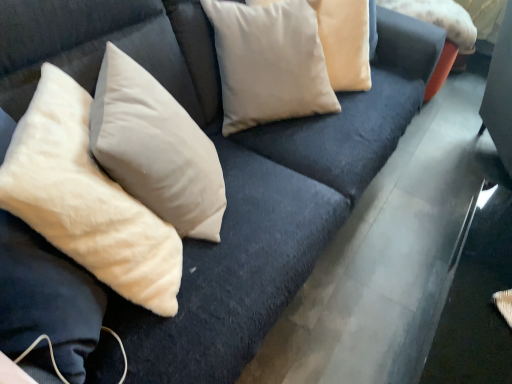
What do you see at coordinates (269, 63) in the screenshot?
I see `beige velvet pillow at upper center, acting as the 3th pillow starting from the right` at bounding box center [269, 63].

Measure the distance between point [83,258] and camera.

Point [83,258] is 33.46 inches from camera.

What is the approximate width of beige cotton pillow at upper center, placed as the 2th pillow when sorted from right to left?

The width of beige cotton pillow at upper center, placed as the 2th pillow when sorted from right to left, is 17.04 inches.

Image resolution: width=512 pixels, height=384 pixels. What are the coordinates of `beige velvet pillow at upper center, the 2th pillow viewed from the left` in the screenshot? It's located at (269, 63).

Is beige cotton pillow at upper center, which appears as the third pillow when viewed from the left, at the back of beige velvet pillow at upper center, the 2th pillow viewed from the left?

No, beige cotton pillow at upper center, which appears as the third pillow when viewed from the left, is not at the back of beige velvet pillow at upper center, the 2th pillow viewed from the left.

In the scene shown: Considering the relative sizes of beige velvet pillow at upper center, acting as the 3th pillow starting from the right, and beige cotton pillow at upper center, placed as the 2th pillow when sorted from right to left, in the image provided, is beige velvet pillow at upper center, acting as the 3th pillow starting from the right, smaller than beige cotton pillow at upper center, placed as the 2th pillow when sorted from right to left,?

Yes, beige velvet pillow at upper center, acting as the 3th pillow starting from the right, is smaller than beige cotton pillow at upper center, placed as the 2th pillow when sorted from right to left.

Is beige velvet pillow at upper center, acting as the 3th pillow starting from the right, situated inside beige cotton pillow at upper center, which appears as the third pillow when viewed from the left, or outside?

beige velvet pillow at upper center, acting as the 3th pillow starting from the right, is located beyond the bounds of beige cotton pillow at upper center, which appears as the third pillow when viewed from the left.

Considering the points (322, 89) and (350, 45), which point is in front, point (322, 89) or point (350, 45)?

The point (322, 89) is closer.

Which object is more forward, beige velvet pillow at upper center, acting as the 3th pillow starting from the right, or beige soft pillow at left, the 4th pillow viewed from the right?

beige soft pillow at left, the 4th pillow viewed from the right.

Is beige velvet pillow at upper center, acting as the 3th pillow starting from the right, facing away from beige soft pillow at left, the first pillow from the left?

beige velvet pillow at upper center, acting as the 3th pillow starting from the right, does not have its back to beige soft pillow at left, the first pillow from the left.

From a real-world perspective, which object stands above the other?

beige soft pillow at left, the first pillow from the left, is physically above.

How distant is beige velvet pillow at upper center, acting as the 3th pillow starting from the right, from beige soft pillow at left, the first pillow from the left?

A distance of 27.03 inches exists between beige velvet pillow at upper center, acting as the 3th pillow starting from the right, and beige soft pillow at left, the first pillow from the left.

From a real-world perspective, is beige soft pillow at left, the first pillow from the left, over beige cotton pillow at upper right, the fourth pillow when ordered from left to right?

Yes, from a real-world perspective, beige soft pillow at left, the first pillow from the left, is on top of beige cotton pillow at upper right, the fourth pillow when ordered from left to right.

Which object is wider, beige soft pillow at left, the first pillow from the left, or beige cotton pillow at upper right, the first pillow from the right?

beige soft pillow at left, the first pillow from the left.

Which is behind, beige soft pillow at left, the 4th pillow viewed from the right, or beige cotton pillow at upper right, the first pillow from the right?

beige cotton pillow at upper right, the first pillow from the right, is more distant.

Considering the sizes of beige soft pillow at left, the first pillow from the left, and beige cotton pillow at upper center, which appears as the third pillow when viewed from the left, in the image, is beige soft pillow at left, the first pillow from the left, bigger or smaller than beige cotton pillow at upper center, which appears as the third pillow when viewed from the left,?

beige soft pillow at left, the first pillow from the left, is bigger than beige cotton pillow at upper center, which appears as the third pillow when viewed from the left.

Is beige soft pillow at left, the first pillow from the left, touching beige cotton pillow at upper center, placed as the 2th pillow when sorted from right to left?

No, beige soft pillow at left, the first pillow from the left, is not making contact with beige cotton pillow at upper center, placed as the 2th pillow when sorted from right to left.

In the image, is beige soft pillow at left, the first pillow from the left, positioned in front of or behind beige cotton pillow at upper center, placed as the 2th pillow when sorted from right to left?

beige soft pillow at left, the first pillow from the left, is in front of beige cotton pillow at upper center, placed as the 2th pillow when sorted from right to left.

At what (x,y) coordinates should I click in order to perform the action: click on the 2nd pillow in front when counting from the beige cotton pillow at upper center, which appears as the third pillow when viewed from the left. Please return your answer as a coordinate pair (x, y). This screenshot has width=512, height=384. Looking at the image, I should click on (86, 199).

Which of these two, beige cotton pillow at upper right, the first pillow from the right, or beige soft pillow at left, the first pillow from the left, stands shorter?

With less height is beige cotton pillow at upper right, the first pillow from the right.

Is beige cotton pillow at upper right, the first pillow from the right, next to beige soft pillow at left, the first pillow from the left, and touching it?

beige cotton pillow at upper right, the first pillow from the right, is not next to beige soft pillow at left, the first pillow from the left, and they're not touching.

From a real-world perspective, is beige cotton pillow at upper right, the fourth pillow when ordered from left to right, positioned above or below beige soft pillow at left, the first pillow from the left?

In terms of real-world spatial position, beige cotton pillow at upper right, the fourth pillow when ordered from left to right, is below beige soft pillow at left, the first pillow from the left.

Could you tell me if beige cotton pillow at upper center, which appears as the third pillow when viewed from the left, is turned towards beige cotton pillow at upper right, the fourth pillow when ordered from left to right?

No, beige cotton pillow at upper center, which appears as the third pillow when viewed from the left, does not turn towards beige cotton pillow at upper right, the fourth pillow when ordered from left to right.

Does beige cotton pillow at upper center, placed as the 2th pillow when sorted from right to left, appear on the right side of beige cotton pillow at upper right, the first pillow from the right?

Incorrect, beige cotton pillow at upper center, placed as the 2th pillow when sorted from right to left, is not on the right side of beige cotton pillow at upper right, the first pillow from the right.

Is beige cotton pillow at upper center, placed as the 2th pillow when sorted from right to left, not inside beige cotton pillow at upper right, the fourth pillow when ordered from left to right?

That's correct, beige cotton pillow at upper center, placed as the 2th pillow when sorted from right to left, is outside of beige cotton pillow at upper right, the fourth pillow when ordered from left to right.

Is beige cotton pillow at upper center, which appears as the third pillow when viewed from the left, wider than beige cotton pillow at upper right, the fourth pillow when ordered from left to right?

Correct, the width of beige cotton pillow at upper center, which appears as the third pillow when viewed from the left, exceeds that of beige cotton pillow at upper right, the fourth pillow when ordered from left to right.

Which object is further away from the camera taking this photo, beige soft pillow at left, the 4th pillow viewed from the right, or beige velvet pillow at upper center, the 2th pillow viewed from the left?

beige velvet pillow at upper center, the 2th pillow viewed from the left, is further away from the camera.

Is beige soft pillow at left, the first pillow from the left, taller than beige velvet pillow at upper center, the 2th pillow viewed from the left?

Correct, beige soft pillow at left, the first pillow from the left, is much taller as beige velvet pillow at upper center, the 2th pillow viewed from the left.

From the image's perspective, who appears lower, beige soft pillow at left, the 4th pillow viewed from the right, or beige velvet pillow at upper center, acting as the 3th pillow starting from the right?

From the image's view, beige soft pillow at left, the 4th pillow viewed from the right, is below.

Image resolution: width=512 pixels, height=384 pixels. What are the coordinates of `the 1st pillow behind the beige velvet pillow at upper center, the 2th pillow viewed from the left, starting your count from the anchor` in the screenshot? It's located at (345, 42).

Identify the location of pillow lying on the left of beige velvet pillow at upper center, the 2th pillow viewed from the left. The image size is (512, 384). (86, 199).

Based on their spatial positions, is beige velvet pillow at upper center, acting as the 3th pillow starting from the right, or beige cotton pillow at upper right, the fourth pillow when ordered from left to right, further from beige soft pillow at left, the 4th pillow viewed from the right?

beige cotton pillow at upper right, the fourth pillow when ordered from left to right.

Looking at the image, which one is located further to beige soft pillow at left, the 4th pillow viewed from the right, beige cotton pillow at upper right, the fourth pillow when ordered from left to right, or beige velvet pillow at upper center, acting as the 3th pillow starting from the right?

The object further to beige soft pillow at left, the 4th pillow viewed from the right, is beige cotton pillow at upper right, the fourth pillow when ordered from left to right.

Considering their positions, is beige cotton pillow at upper center, placed as the 2th pillow when sorted from right to left, positioned closer to beige soft pillow at left, the first pillow from the left, than beige velvet pillow at upper center, acting as the 3th pillow starting from the right?

Among the two, beige velvet pillow at upper center, acting as the 3th pillow starting from the right, is located nearer to beige soft pillow at left, the first pillow from the left.

Based on their spatial positions, is beige cotton pillow at upper center, which appears as the third pillow when viewed from the left, or beige cotton pillow at upper right, the first pillow from the right, further from beige soft pillow at left, the first pillow from the left?

The object further to beige soft pillow at left, the first pillow from the left, is beige cotton pillow at upper right, the first pillow from the right.

Looking at the image, which one is located further to beige cotton pillow at upper right, the first pillow from the right, beige soft pillow at left, the first pillow from the left, or beige cotton pillow at upper center, which appears as the third pillow when viewed from the left?

beige soft pillow at left, the first pillow from the left, lies further to beige cotton pillow at upper right, the first pillow from the right, than the other object.

When comparing their distances from beige velvet pillow at upper center, acting as the 3th pillow starting from the right, does beige soft pillow at left, the first pillow from the left, or beige cotton pillow at upper center, placed as the 2th pillow when sorted from right to left, seem closer?

beige cotton pillow at upper center, placed as the 2th pillow when sorted from right to left, is positioned closer to the anchor beige velvet pillow at upper center, acting as the 3th pillow starting from the right.

Based on their spatial positions, is beige cotton pillow at upper center, placed as the 2th pillow when sorted from right to left, or beige cotton pillow at upper right, the first pillow from the right, closer to beige velvet pillow at upper center, the 2th pillow viewed from the left?

The object closer to beige velvet pillow at upper center, the 2th pillow viewed from the left, is beige cotton pillow at upper center, placed as the 2th pillow when sorted from right to left.

Based on their spatial positions, is beige cotton pillow at upper center, placed as the 2th pillow when sorted from right to left, or beige velvet pillow at upper center, the 2th pillow viewed from the left, closer to beige cotton pillow at upper right, the fourth pillow when ordered from left to right?

beige cotton pillow at upper center, placed as the 2th pillow when sorted from right to left, is positioned closer to the anchor beige cotton pillow at upper right, the fourth pillow when ordered from left to right.

Locate an element on the screen. Image resolution: width=512 pixels, height=384 pixels. pillow located between beige velvet pillow at upper center, the 2th pillow viewed from the left, and beige cotton pillow at upper right, the first pillow from the right, in the depth direction is located at coordinates (345, 42).

The height and width of the screenshot is (384, 512). What are the coordinates of `pillow positioned between beige soft pillow at left, the 4th pillow viewed from the right, and beige cotton pillow at upper center, placed as the 2th pillow when sorted from right to left, from near to far` in the screenshot? It's located at (269, 63).